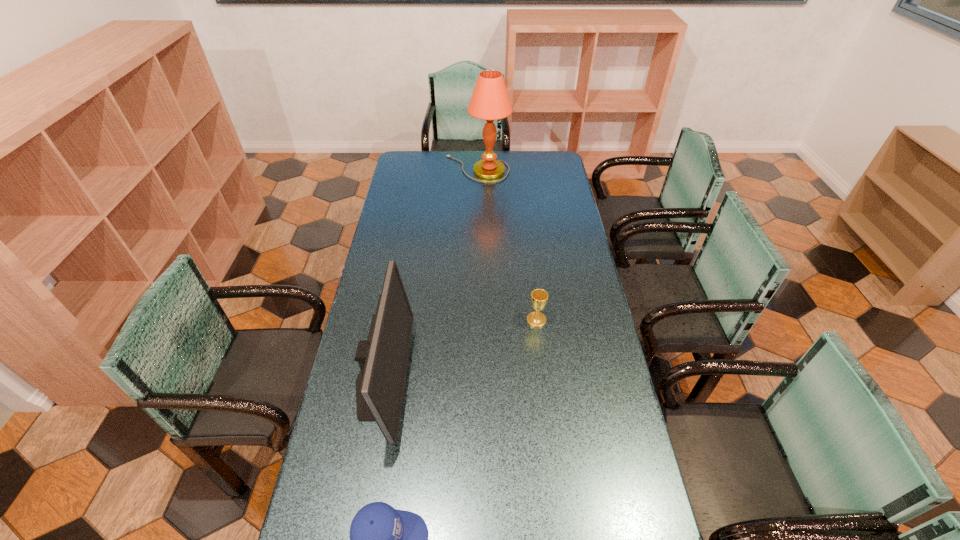
The height and width of the screenshot is (540, 960). In the image, there is a desktop. Identify the location of vacant space at the far edge. (510, 171).

In the image, there is a desktop. Find the location of `vacant space at the left edge`. vacant space at the left edge is located at coordinates (407, 260).

You are a GUI agent. You are given a task and a screenshot of the screen. Output one action in this format:
    pyautogui.click(x=<x>, y=<y>)
    Task: Click on the vacant region at the right edge of the desktop
    This screenshot has height=540, width=960.
    Given the screenshot: What is the action you would take?
    pyautogui.click(x=561, y=219)

Locate an element on the screen. The height and width of the screenshot is (540, 960). free space between the rightmost object and the farthest object is located at coordinates (507, 245).

Find the location of `vacant area that lies between the farthest object and the third tallest object`. vacant area that lies between the farthest object and the third tallest object is located at coordinates (507, 245).

The height and width of the screenshot is (540, 960). Find the location of `vacant area between the second tallest object and the rightmost object`. vacant area between the second tallest object and the rightmost object is located at coordinates (459, 350).

I want to click on free space between the chalice and the third shortest object, so click(459, 350).

You are a GUI agent. You are given a task and a screenshot of the screen. Output one action in this format:
    pyautogui.click(x=<x>, y=<y>)
    Task: Click on the vacant point located between the third shortest object and the chalice
    The width and height of the screenshot is (960, 540).
    Given the screenshot: What is the action you would take?
    pyautogui.click(x=459, y=350)

What are the coordinates of `free space between the rightmost object and the lamp` in the screenshot? It's located at (507, 245).

Identify the location of the second closest object to the rightmost object. Image resolution: width=960 pixels, height=540 pixels. (382, 539).